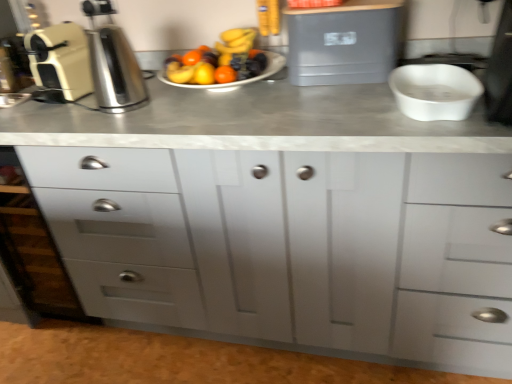
Question: In terms of size, does gray plastic container at upper center, the second appliance in the left-to-right sequence, appear bigger or smaller than white matte drawer at left?

Choices:
 (A) small
 (B) big

Answer: (A)

Question: From a real-world perspective, is gray plastic container at upper center, the second appliance in the left-to-right sequence, physically located above or below white matte drawer at left?

Choices:
 (A) below
 (B) above

Answer: (B)

Question: Which is farther from the white matte drawer at left?

Choices:
 (A) white matte chest of drawers at center
 (B) white glossy mixing bowl at right
 (C) gray plastic container at upper center, the 1th appliance positioned from the right
 (D) cream matte coffee machine at left, the 2th appliance in the right-to-left sequence
 (E) satin silver coffee machine at left

Answer: (B)

Question: Based on their relative distances, which object is nearer to the satin silver coffee machine at left?

Choices:
 (A) cream matte coffee machine at left, the 2th appliance in the right-to-left sequence
 (B) white matte chest of drawers at center
 (C) white matte drawer at left
 (D) white glossy mixing bowl at right
 (E) gray plastic container at upper center, the second appliance in the left-to-right sequence

Answer: (A)